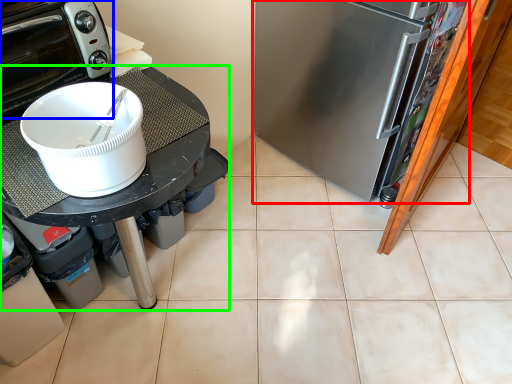
Question: Which is nearer to the refrigerator (highlighted by a red box)? home appliance (highlighted by a blue box) or table (highlighted by a green box).

Choices:
 (A) home appliance
 (B) table

Answer: (B)